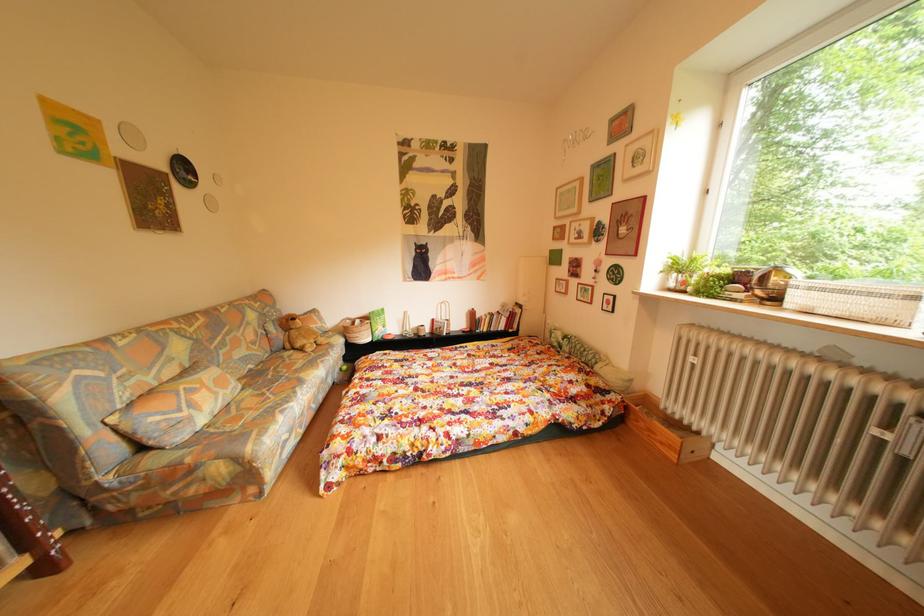
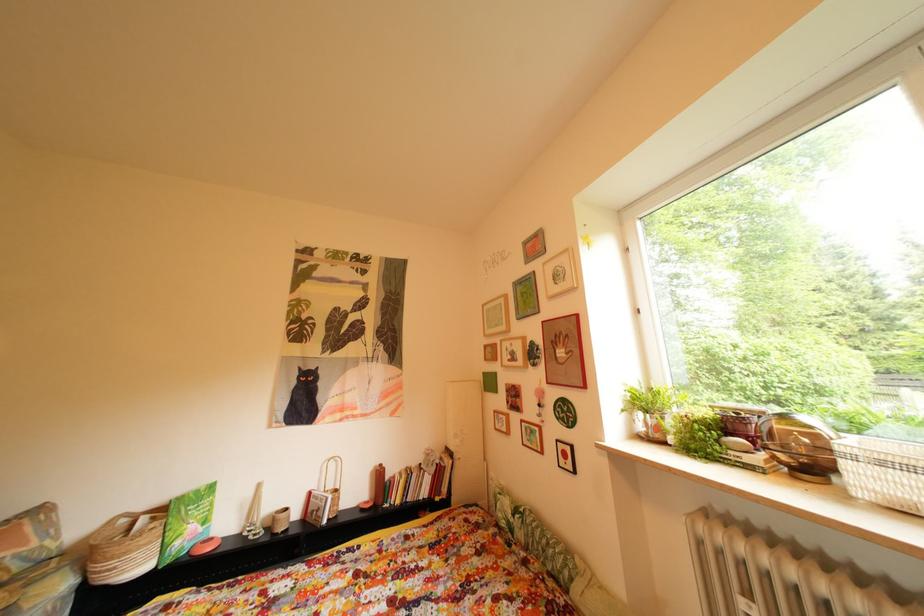
The images are taken continuously from a first-person perspective. In which direction are you moving?

The movement direction of the cameraman is right, forward.